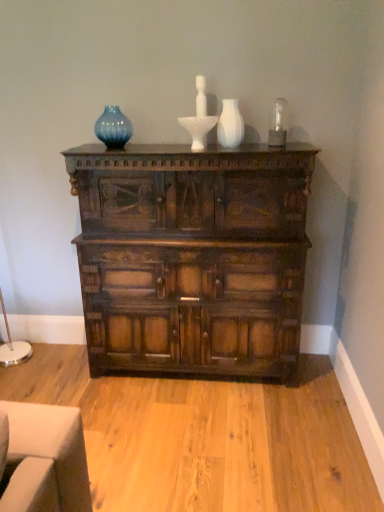
Question: In the image, is blue glass vase at upper center positioned in front of or behind white matte vase at center?

Choices:
 (A) front
 (B) behind

Answer: (B)

Question: Is blue glass vase at upper center taller or shorter than white matte vase at center?

Choices:
 (A) short
 (B) tall

Answer: (A)

Question: Considering the real-world distances, which object is closest to the white matte vase at center?

Choices:
 (A) dark wood chest of drawers at center
 (B) blue glass vase at upper center

Answer: (B)

Question: Which object is positioned farthest from the dark wood chest of drawers at center?

Choices:
 (A) white matte vase at center
 (B) blue glass vase at upper center

Answer: (B)